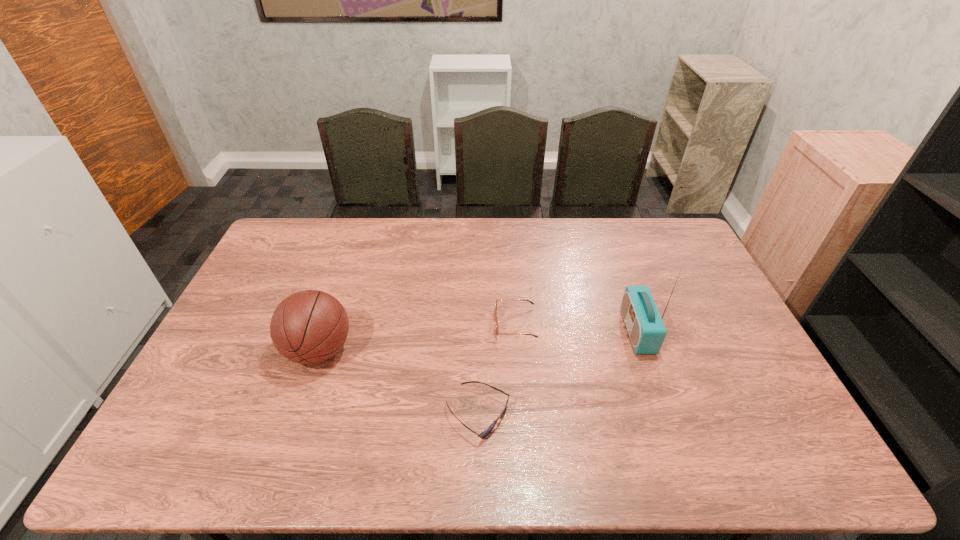
In the image, there is a desktop. At what (x,y) coordinates should I click in order to perform the action: click on vacant space at the right edge. Please return your answer as a coordinate pair (x, y). This screenshot has height=540, width=960. Looking at the image, I should click on (792, 421).

In the image, there is a desktop. At what (x,y) coordinates should I click in order to perform the action: click on free region at the near right corner. Please return your answer as a coordinate pair (x, y). Looking at the image, I should click on (746, 458).

Locate an element on the screen. free space between the basketball and the taller sunglasses is located at coordinates (418, 337).

Find the location of a particular element. empty space that is in between the second tallest object and the taller sunglasses is located at coordinates (418, 337).

This screenshot has width=960, height=540. Identify the location of free space that is in between the third shortest object and the radio receiver. (478, 341).

Identify the location of free spot between the third shortest object and the farther sunglasses. (418, 337).

In order to click on vacant space in between the farther sunglasses and the second tallest object in this screenshot , I will do `click(418, 337)`.

Where is `vacant area that lies between the tallest object and the nearer sunglasses`? vacant area that lies between the tallest object and the nearer sunglasses is located at coordinates click(x=558, y=373).

This screenshot has width=960, height=540. I want to click on free space between the taller sunglasses and the nearer sunglasses, so click(496, 369).

Identify the location of vacant point located between the farther sunglasses and the nearer sunglasses. The height and width of the screenshot is (540, 960). (496, 369).